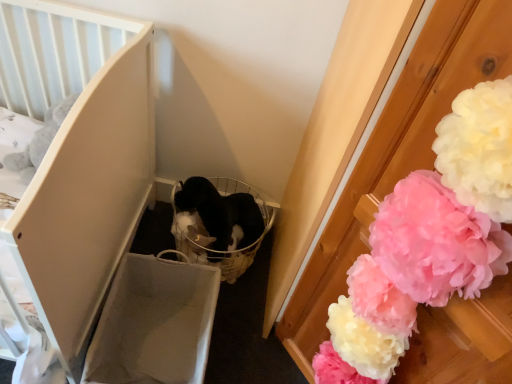
Question: Considering the relative sizes of white fluffy pom-pom at right and matte white crib at left in the image provided, is white fluffy pom-pom at right wider than matte white crib at left?

Choices:
 (A) no
 (B) yes

Answer: (A)

Question: Can you confirm if white fluffy pom-pom at right is positioned to the left of matte white crib at left?

Choices:
 (A) yes
 (B) no

Answer: (B)

Question: Is white fluffy pom-pom at right positioned behind matte white crib at left?

Choices:
 (A) no
 (B) yes

Answer: (A)

Question: Is matte white crib at left completely or partially inside white fluffy pom-pom at right?

Choices:
 (A) yes
 (B) no

Answer: (B)

Question: Does white fluffy pom-pom at right have a lesser height compared to matte white crib at left?

Choices:
 (A) no
 (B) yes

Answer: (A)

Question: Considering the relative sizes of white fluffy pom-pom at right and matte white crib at left in the image provided, is white fluffy pom-pom at right thinner than matte white crib at left?

Choices:
 (A) yes
 (B) no

Answer: (A)

Question: Does matte white crib at left have a greater height compared to white fluffy pom-pom at right?

Choices:
 (A) no
 (B) yes

Answer: (A)

Question: Is matte white crib at left facing away from white fluffy pom-pom at right?

Choices:
 (A) no
 (B) yes

Answer: (A)

Question: Is matte white crib at left outside white fluffy pom-pom at right?

Choices:
 (A) no
 (B) yes

Answer: (B)

Question: Is matte white crib at left further to the viewer compared to white fluffy pom-pom at right?

Choices:
 (A) yes
 (B) no

Answer: (A)

Question: Is matte white crib at left at the left side of white fluffy pom-pom at right?

Choices:
 (A) no
 (B) yes

Answer: (B)

Question: From a real-world perspective, is matte white crib at left on white fluffy pom-pom at right?

Choices:
 (A) no
 (B) yes

Answer: (A)

Question: From the image's perspective, is matte white crib at left above or below white fluffy pom-pom at right?

Choices:
 (A) below
 (B) above

Answer: (B)